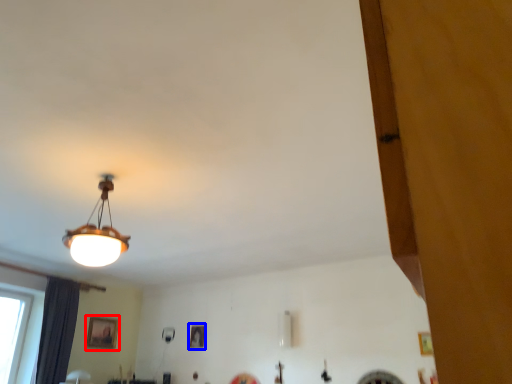
Question: Which of the following is the closest to the observer, picture frame (highlighted by a red box) or picture frame (highlighted by a blue box)?

Choices:
 (A) picture frame
 (B) picture frame

Answer: (A)